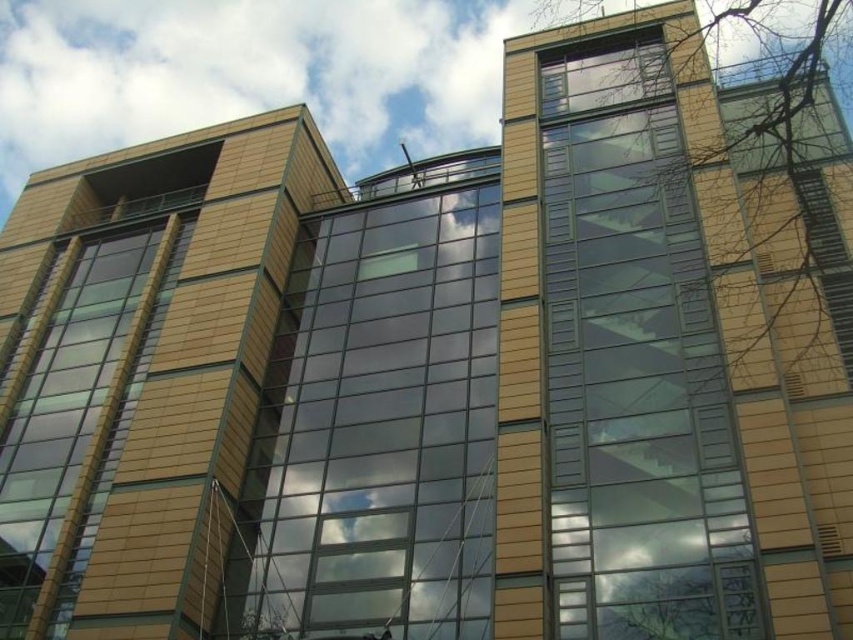
Between transparent glass window at center and matte glass window at left, which one is positioned higher?

transparent glass window at center is above.

Who is positioned more to the left, transparent glass window at center or matte glass window at left?

matte glass window at left is more to the left.

You are a GUI agent. You are given a task and a screenshot of the screen. Output one action in this format:
    pyautogui.click(x=<x>, y=<y>)
    Task: Click on the transparent glass window at center
    
    Given the screenshot: What is the action you would take?
    376,429

Measure the distance between transparent glass window at upper right and transparent glass window at center.

A distance of 36.58 feet exists between transparent glass window at upper right and transparent glass window at center.

Can you confirm if transparent glass window at upper right is thinner than transparent glass window at center?

Yes.

This screenshot has width=853, height=640. Describe the element at coordinates (634, 364) in the screenshot. I see `transparent glass window at upper right` at that location.

This screenshot has width=853, height=640. In order to click on transparent glass window at upper right in this screenshot , I will do `click(634, 364)`.

Who is positioned more to the right, transparent glass window at upper right or matte glass window at left?

Positioned to the right is transparent glass window at upper right.

Does point (685, 428) come behind point (68, 532)?

No, it is not.

Where is `transparent glass window at upper right`? The height and width of the screenshot is (640, 853). transparent glass window at upper right is located at coordinates (634, 364).